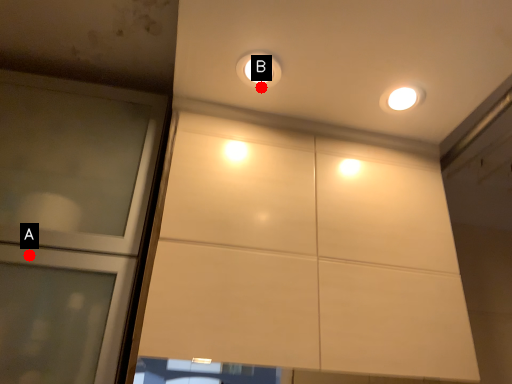
Question: Two points are circled on the image, labeled by A and B beside each circle. Which of the following is the farthest from the observer?

Choices:
 (A) A is further
 (B) B is further

Answer: (B)